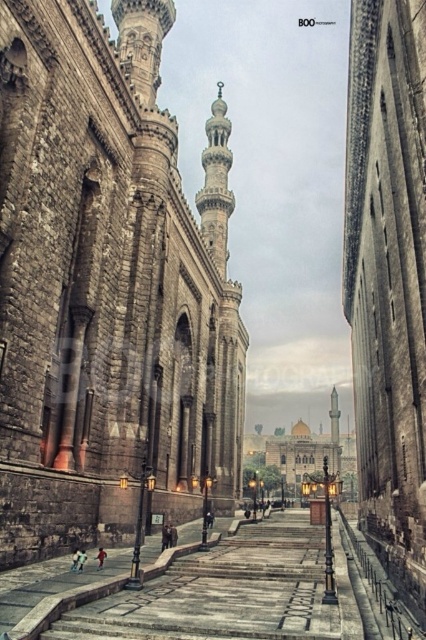
Question: Based on their relative distances, which object is farther from the stone minaret at center?

Choices:
 (A) polished stone minaret at upper center
 (B) dark brown stone tower at center

Answer: (B)

Question: Is polished stone minaret at upper center to the right of smooth stone minaret at center from the viewer's perspective?

Choices:
 (A) yes
 (B) no

Answer: (B)

Question: Which point is closer to the camera?

Choices:
 (A) (204, 230)
 (B) (143, 460)

Answer: (B)

Question: Which object is farther from the camera taking this photo?

Choices:
 (A) stone minaret at center
 (B) polished stone minaret at upper center

Answer: (B)

Question: Does polished stone minaret at upper center have a lesser width compared to smooth stone minaret at center?

Choices:
 (A) no
 (B) yes

Answer: (A)

Question: Does dark brown stone tower at center have a smaller size compared to polished stone minaret at upper center?

Choices:
 (A) no
 (B) yes

Answer: (A)